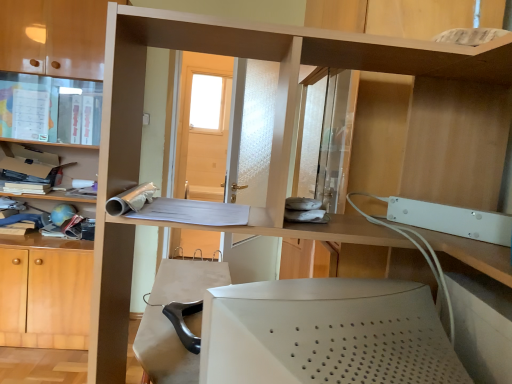
Question: Can you confirm if wooden shelf at upper right, the second shelf positioned from the left, is shorter than matte plastic cabinet at upper left?

Choices:
 (A) no
 (B) yes

Answer: (B)

Question: Is wooden shelf at upper right, which appears as the first shelf when viewed from the right, directly adjacent to matte plastic cabinet at upper left?

Choices:
 (A) no
 (B) yes

Answer: (A)

Question: Is wooden shelf at upper right, the second shelf positioned from the left, facing towards matte plastic cabinet at upper left?

Choices:
 (A) yes
 (B) no

Answer: (B)

Question: Is wooden shelf at upper right, which ranks as the first shelf in front-to-back order, outside of matte plastic cabinet at upper left?

Choices:
 (A) yes
 (B) no

Answer: (A)

Question: From a real-world perspective, is wooden shelf at upper right, which appears as the first shelf when viewed from the right, positioned under matte plastic cabinet at upper left based on gravity?

Choices:
 (A) no
 (B) yes

Answer: (A)

Question: Does wooden shelf at upper right, which appears as the first shelf when viewed from the right, come behind matte plastic cabinet at upper left?

Choices:
 (A) no
 (B) yes

Answer: (A)

Question: Is matte plastic cabinet at upper left a part of white matte desktop computer at lower center?

Choices:
 (A) no
 (B) yes

Answer: (A)

Question: From the image's perspective, does white matte desktop computer at lower center appear higher than matte plastic cabinet at upper left?

Choices:
 (A) yes
 (B) no

Answer: (B)

Question: Can you confirm if white matte desktop computer at lower center is taller than matte plastic cabinet at upper left?

Choices:
 (A) no
 (B) yes

Answer: (A)

Question: Does white matte desktop computer at lower center come behind matte plastic cabinet at upper left?

Choices:
 (A) no
 (B) yes

Answer: (A)

Question: Is white matte desktop computer at lower center to the left of matte plastic cabinet at upper left from the viewer's perspective?

Choices:
 (A) yes
 (B) no

Answer: (B)

Question: Can you confirm if white matte desktop computer at lower center is smaller than matte plastic cabinet at upper left?

Choices:
 (A) yes
 (B) no

Answer: (A)

Question: Is matte plastic shelf at left, the 1th shelf positioned from the back, located outside white matte desktop computer at lower center?

Choices:
 (A) no
 (B) yes

Answer: (B)